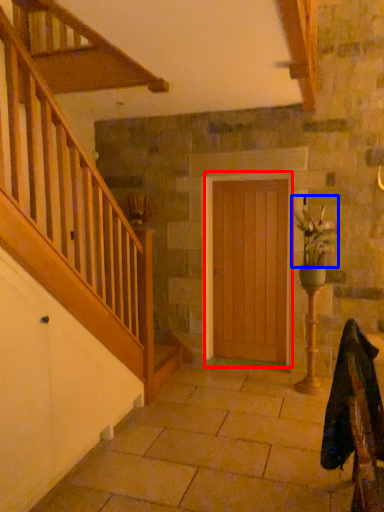
Question: Which object appears farthest to the camera in this image, door (highlighted by a red box) or floral arrangement (highlighted by a blue box)?

Choices:
 (A) door
 (B) floral arrangement

Answer: (A)